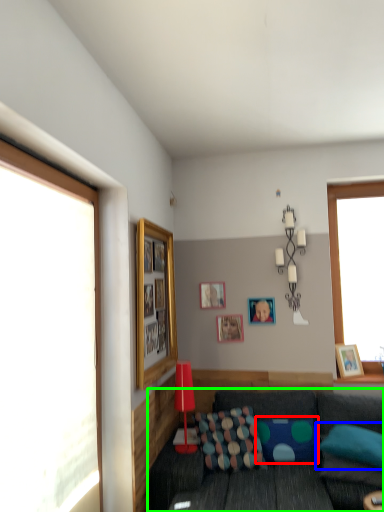
Question: Considering the real-world distances, which object is closest to pillow (highlighted by a red box)? pillow (highlighted by a blue box) or studio couch (highlighted by a green box).

Choices:
 (A) pillow
 (B) studio couch

Answer: (B)